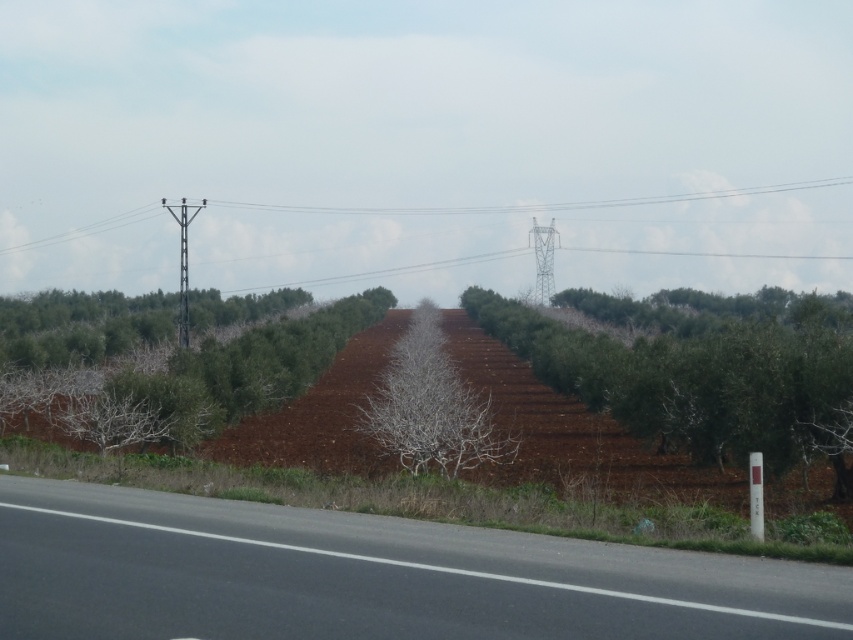
In the scene shown: You are standing at the center of the road and want to walk towards the bare branches at center. Which direction should you face?

The bare branches at center are located at point 0.636 on the x axis and 0.505 on the y axis. Since you are at the center of the road, you should face towards the direction of the coordinates to reach them. However, without a compass or map, it is difficult to determine the exact direction. Alternatively, if the road is running parallel to the field, you can use the road as a reference. Since the bare branches are at the center of the image, facing towards the middle of the scene would align you with their